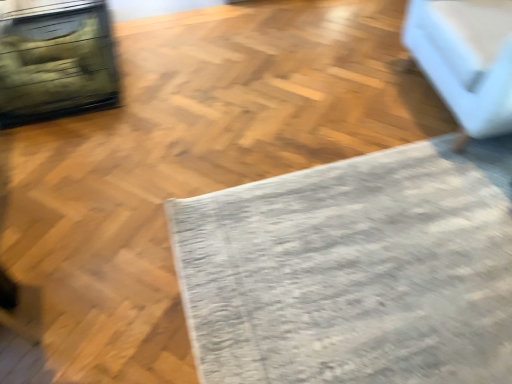
Image resolution: width=512 pixels, height=384 pixels. Identify the location of vacant space underneath gray textured mat at center (from a real-world perspective). (374, 257).